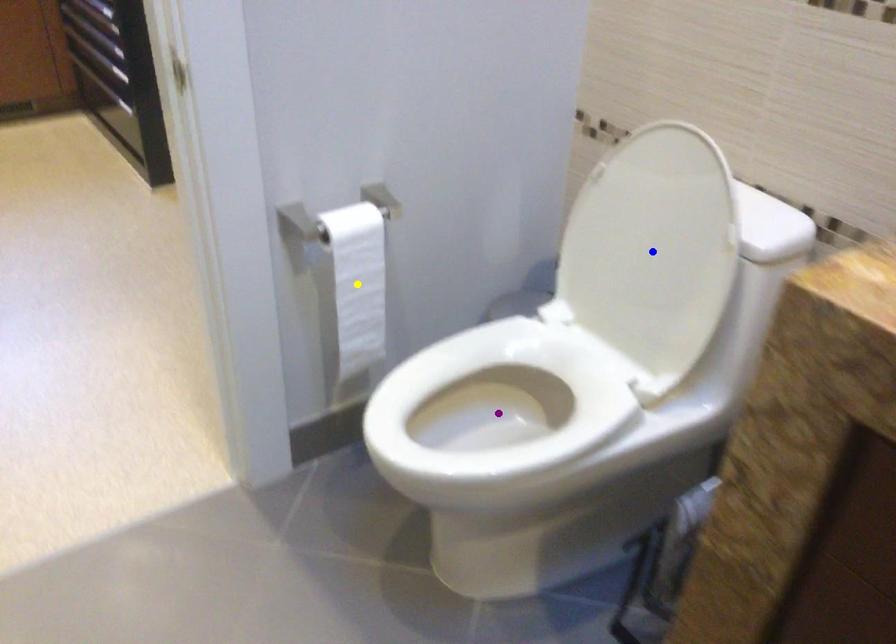
Order these from nearest to farthest:
yellow point, purple point, blue point

purple point, blue point, yellow point